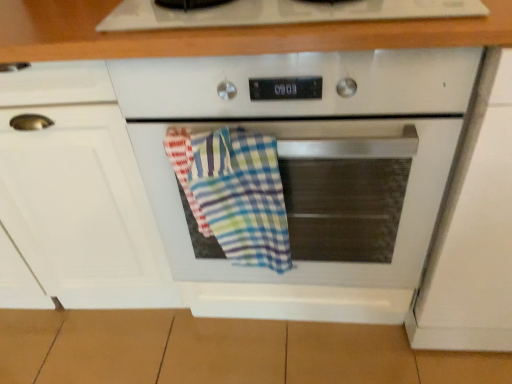
This screenshot has height=384, width=512. What do you see at coordinates (234, 193) in the screenshot? I see `multicolored checkered towel at center` at bounding box center [234, 193].

In order to face white glossy oven at center, should I rotate leftwards or rightwards?

A 4.923 degree turn to the right will do.

Looking at this image, what is the approximate width of white matte cabinet at left, which is counted as the second cabinetry, starting from the right?

white matte cabinet at left, which is counted as the second cabinetry, starting from the right, is 23.69 inches wide.

What do you see at coordinates (79, 191) in the screenshot? I see `white matte cabinet at left, which is counted as the second cabinetry, starting from the right` at bounding box center [79, 191].

This screenshot has width=512, height=384. I want to click on multicolored checkered towel at center, so click(x=234, y=193).

From a real-world perspective, is white matte cabinet at left, which is counted as the second cabinetry, starting from the right, over white matte cabinet at right, which is counted as the 2th cabinetry, starting from the left?

Incorrect, from a real-world perspective, white matte cabinet at left, which is counted as the second cabinetry, starting from the right, is lower than white matte cabinet at right, which is counted as the 2th cabinetry, starting from the left.

Would you say white matte cabinet at left, which is counted as the second cabinetry, starting from the right, is outside white matte cabinet at right, which is counted as the 2th cabinetry, starting from the left?

Absolutely, white matte cabinet at left, which is counted as the second cabinetry, starting from the right, is external to white matte cabinet at right, which is counted as the 2th cabinetry, starting from the left.

Is white matte cabinet at left, which is counted as the second cabinetry, starting from the right, wider than white matte cabinet at right, the 1th cabinetry from the right?

Incorrect, the width of white matte cabinet at left, which is counted as the second cabinetry, starting from the right, does not surpass that of white matte cabinet at right, the 1th cabinetry from the right.

Is white matte cabinet at left, marked as the 1th cabinetry in a left-to-right arrangement, far from white matte cabinet at right, the 1th cabinetry from the right?

They are positioned close to each other.

Between multicolored checkered towel at center and white matte cabinet at right, the 1th cabinetry from the right, which one has less height?

multicolored checkered towel at center.

Locate an element on the screen. beach towel above the white matte cabinet at right, the 1th cabinetry from the right (from a real-world perspective) is located at coordinates (234, 193).

Looking at the image, does multicolored checkered towel at center seem bigger or smaller compared to white matte cabinet at right, which is counted as the 2th cabinetry, starting from the left?

Considering their sizes, multicolored checkered towel at center takes up less space than white matte cabinet at right, which is counted as the 2th cabinetry, starting from the left.

Choose the correct answer: Is white matte cabinet at right, which is counted as the 2th cabinetry, starting from the left, inside multicolored checkered towel at center or outside it?

white matte cabinet at right, which is counted as the 2th cabinetry, starting from the left, is not enclosed by multicolored checkered towel at center.

Between white matte cabinet at right, the 1th cabinetry from the right, and multicolored checkered towel at center, which one has less height?

multicolored checkered towel at center.

Is white matte cabinet at right, which is counted as the 2th cabinetry, starting from the left, oriented away from multicolored checkered towel at center?

No, white matte cabinet at right, which is counted as the 2th cabinetry, starting from the left,'s orientation is not away from multicolored checkered towel at center.

From a real-world perspective, between white matte cabinet at right, the 1th cabinetry from the right, and white glossy oven at center, who is vertically lower?

white glossy oven at center, from a real-world perspective.

Is white matte cabinet at right, the 1th cabinetry from the right, facing away from white glossy oven at center?

No.

Does white matte cabinet at right, the 1th cabinetry from the right, have a larger size compared to white glossy oven at center?

Incorrect, white matte cabinet at right, the 1th cabinetry from the right, is not larger than white glossy oven at center.

Is white matte cabinet at right, the 1th cabinetry from the right, further to camera compared to white glossy oven at center?

No, white matte cabinet at right, the 1th cabinetry from the right, is in front of white glossy oven at center.

Relative to white glossy oven at center, is white matte cabinet at left, marked as the 1th cabinetry in a left-to-right arrangement, in front or behind?

white matte cabinet at left, marked as the 1th cabinetry in a left-to-right arrangement, is positioned farther from the viewer than white glossy oven at center.

Looking at this image, would you say white matte cabinet at left, which is counted as the second cabinetry, starting from the right, contains white glossy oven at center?

No, white glossy oven at center is located outside of white matte cabinet at left, which is counted as the second cabinetry, starting from the right.

Is white matte cabinet at left, marked as the 1th cabinetry in a left-to-right arrangement, smaller than white glossy oven at center?

Incorrect, white matte cabinet at left, marked as the 1th cabinetry in a left-to-right arrangement, is not smaller in size than white glossy oven at center.

Looking at their sizes, would you say white matte cabinet at left, which is counted as the second cabinetry, starting from the right, is wider or thinner than white glossy oven at center?

white matte cabinet at left, which is counted as the second cabinetry, starting from the right, is wider than white glossy oven at center.

Is the surface of white glossy oven at center in direct contact with white matte cabinet at left, which is counted as the second cabinetry, starting from the right?

No, white glossy oven at center is not touching white matte cabinet at left, which is counted as the second cabinetry, starting from the right.

Which is more to the left, white glossy oven at center or white matte cabinet at left, which is counted as the second cabinetry, starting from the right?

white matte cabinet at left, which is counted as the second cabinetry, starting from the right, is more to the left.

From the image's perspective, is white glossy oven at center on white matte cabinet at left, which is counted as the second cabinetry, starting from the right?

No, from the image's perspective, white glossy oven at center is not over white matte cabinet at left, which is counted as the second cabinetry, starting from the right.

Is point (50, 266) positioned after point (191, 143)?

Yes, it is behind point (191, 143).

The width and height of the screenshot is (512, 384). In order to click on cabinetry on the left of multicolored checkered towel at center in this screenshot , I will do tap(79, 191).

Which object is further away from the camera taking this photo, white matte cabinet at left, marked as the 1th cabinetry in a left-to-right arrangement, or multicolored checkered towel at center?

multicolored checkered towel at center is further from the camera.

How different are the orientations of white matte cabinet at left, marked as the 1th cabinetry in a left-to-right arrangement, and multicolored checkered towel at center in degrees?

1.45 degrees.

I want to click on cabinetry on the left of white matte cabinet at right, the 1th cabinetry from the right, so point(79,191).

At what (x,y) coordinates should I click in order to perform the action: click on beach towel that is below the white matte cabinet at right, the 1th cabinetry from the right (from the image's perspective). Please return your answer as a coordinate pair (x, y). Looking at the image, I should click on (234, 193).

When comparing their distances from white matte cabinet at left, marked as the 1th cabinetry in a left-to-right arrangement, does white glossy oven at center or multicolored checkered towel at center seem closer?

white glossy oven at center is positioned closer to the anchor white matte cabinet at left, marked as the 1th cabinetry in a left-to-right arrangement.

When comparing their distances from multicolored checkered towel at center, does white glossy oven at center or white matte cabinet at left, marked as the 1th cabinetry in a left-to-right arrangement, seem further?

white matte cabinet at left, marked as the 1th cabinetry in a left-to-right arrangement, lies further to multicolored checkered towel at center than the other object.

From the image, which object appears to be farther from white matte cabinet at left, marked as the 1th cabinetry in a left-to-right arrangement, multicolored checkered towel at center or white matte cabinet at right, which is counted as the 2th cabinetry, starting from the left?

white matte cabinet at right, which is counted as the 2th cabinetry, starting from the left, lies further to white matte cabinet at left, marked as the 1th cabinetry in a left-to-right arrangement, than the other object.

When comparing their distances from white matte cabinet at left, which is counted as the second cabinetry, starting from the right, does white matte cabinet at right, which is counted as the 2th cabinetry, starting from the left, or white glossy oven at center seem closer?

white glossy oven at center.

From the image, which object appears to be farther from white matte cabinet at right, which is counted as the 2th cabinetry, starting from the left, multicolored checkered towel at center or white matte cabinet at left, marked as the 1th cabinetry in a left-to-right arrangement?

Based on the image, white matte cabinet at left, marked as the 1th cabinetry in a left-to-right arrangement, appears to be further to white matte cabinet at right, which is counted as the 2th cabinetry, starting from the left.

Considering their positions, is white glossy oven at center positioned closer to white matte cabinet at right, which is counted as the 2th cabinetry, starting from the left, than white matte cabinet at left, which is counted as the second cabinetry, starting from the right?

Among the two, white glossy oven at center is located nearer to white matte cabinet at right, which is counted as the 2th cabinetry, starting from the left.

Which object lies further to the anchor point multicolored checkered towel at center, white matte cabinet at right, which is counted as the 2th cabinetry, starting from the left, or white matte cabinet at left, which is counted as the second cabinetry, starting from the right?

white matte cabinet at right, which is counted as the 2th cabinetry, starting from the left, lies further to multicolored checkered towel at center than the other object.

Considering their positions, is multicolored checkered towel at center positioned closer to white glossy oven at center than white matte cabinet at right, the 1th cabinetry from the right?

Among the two, multicolored checkered towel at center is located nearer to white glossy oven at center.

Find the location of a particular element. This screenshot has width=512, height=384. beach towel situated between white matte cabinet at left, which is counted as the second cabinetry, starting from the right, and white matte cabinet at right, the 1th cabinetry from the right, from left to right is located at coordinates (234, 193).

The height and width of the screenshot is (384, 512). In order to click on oven between white matte cabinet at left, which is counted as the second cabinetry, starting from the right, and white matte cabinet at right, the 1th cabinetry from the right in this screenshot , I will do `click(310, 171)`.

Locate an element on the screen. This screenshot has width=512, height=384. oven located between multicolored checkered towel at center and white matte cabinet at right, the 1th cabinetry from the right, in the left-right direction is located at coordinates (310, 171).

The image size is (512, 384). In order to click on beach towel between white matte cabinet at left, which is counted as the second cabinetry, starting from the right, and white glossy oven at center, in the horizontal direction in this screenshot , I will do `click(234, 193)`.